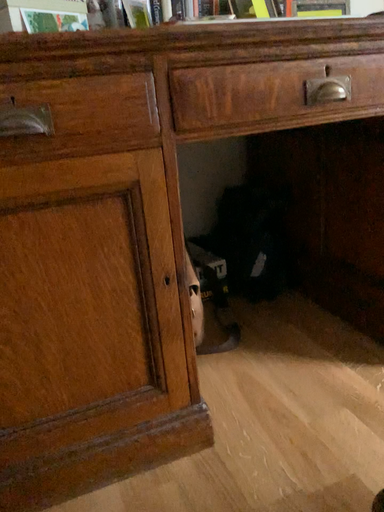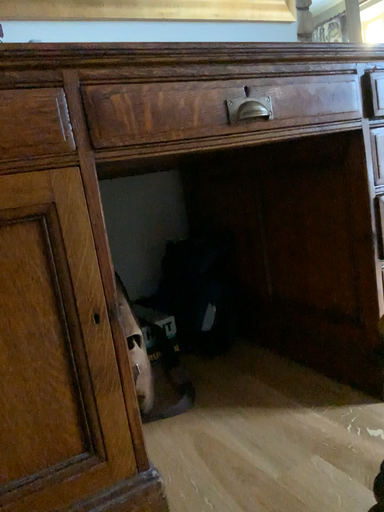
Question: Which way did the camera rotate in the video?

Choices:
 (A) rotated upward
 (B) rotated downward

Answer: (A)